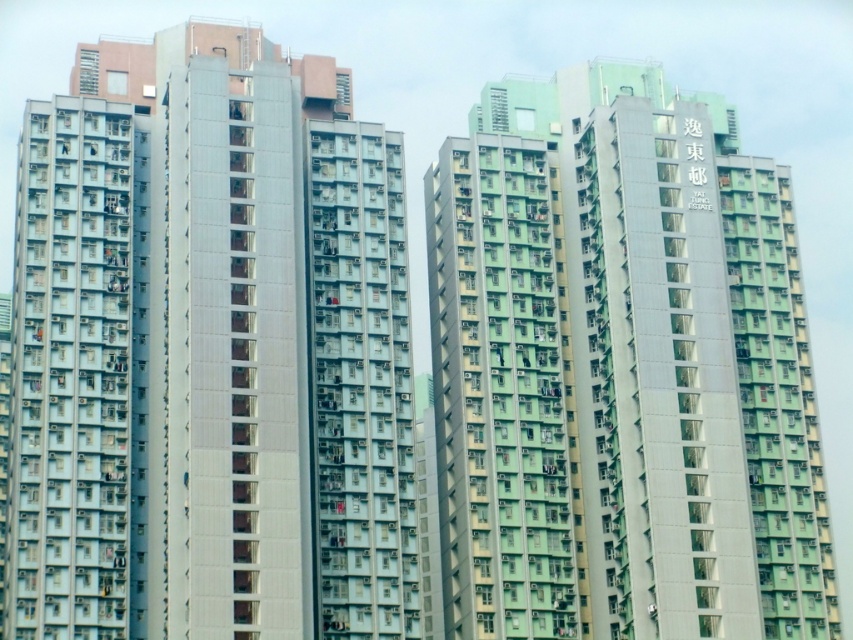
Does white glossy building at center appear on the right side of green matte building at center?

No, white glossy building at center is not to the right of green matte building at center.

Between white glossy building at center and green matte building at center, which one has less height?

With less height is white glossy building at center.

Describe the element at coordinates (209, 352) in the screenshot. I see `white glossy building at center` at that location.

Identify the location of white glossy building at center. (209, 352).